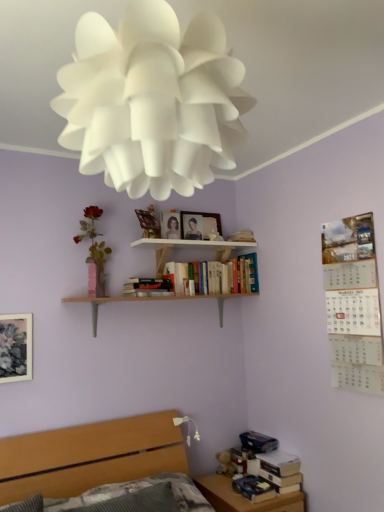
You are a GUI agent. You are given a task and a screenshot of the screen. Output one action in this format:
    pyautogui.click(x=<x>, y=<y>)
    Task: Click on the free space above matte black tool at center, the third book positioned from the top (from a real-world perspective)
    
    Given the screenshot: What is the action you would take?
    pyautogui.click(x=148, y=280)